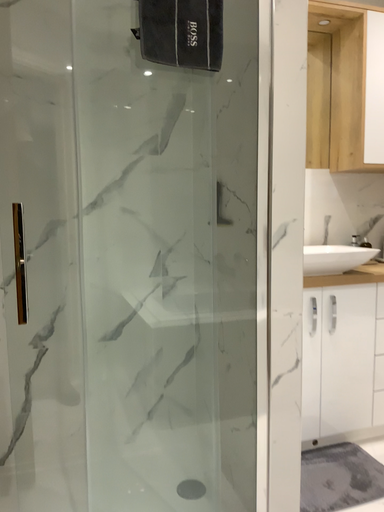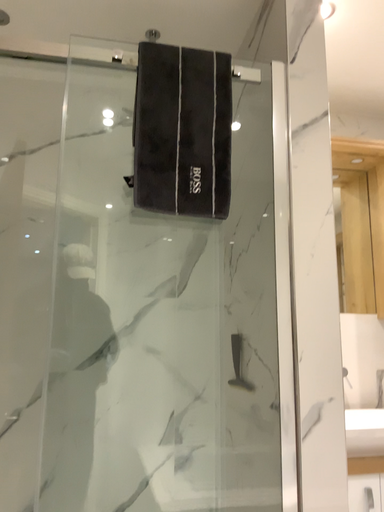
Question: How did the camera likely rotate when shooting the video?

Choices:
 (A) rotated right
 (B) rotated left

Answer: (B)